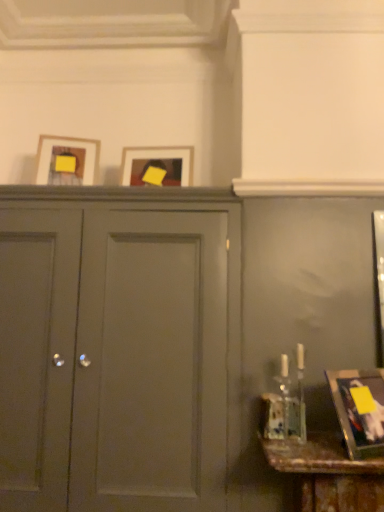
Question: Is matte wooden picture frame at center, the 1th picture frame viewed from the back, aimed at metallic gold picture frame at lower right, the 3th picture frame from the top?

Choices:
 (A) no
 (B) yes

Answer: (A)

Question: Does matte wooden picture frame at center, the 2th picture frame viewed from the right, have a greater width compared to metallic gold picture frame at lower right, acting as the 1th picture frame starting from the right?

Choices:
 (A) no
 (B) yes

Answer: (A)

Question: Is matte wooden picture frame at center, marked as the third picture frame in a front-to-back arrangement, outside of metallic gold picture frame at lower right, arranged as the 1th picture frame when viewed from the front?

Choices:
 (A) no
 (B) yes

Answer: (B)

Question: Does matte wooden picture frame at center, which ranks as the 2th picture frame in bottom-to-top order, come in front of metallic gold picture frame at lower right, the 3th picture frame from the top?

Choices:
 (A) no
 (B) yes

Answer: (A)

Question: Does matte wooden picture frame at center, which is counted as the second picture frame, starting from the left, have a lesser width compared to metallic gold picture frame at lower right, arranged as the 1th picture frame when viewed from the front?

Choices:
 (A) yes
 (B) no

Answer: (A)

Question: Is matte wooden picture frame at center, marked as the third picture frame in a front-to-back arrangement, far away from metallic gold picture frame at lower right, acting as the 1th picture frame starting from the right?

Choices:
 (A) no
 (B) yes

Answer: (B)

Question: From the image's perspective, is matte gray cabinet at center below metallic gold picture frame at lower right, positioned as the first picture frame in bottom-to-top order?

Choices:
 (A) no
 (B) yes

Answer: (A)

Question: Is matte gray cabinet at center facing towards metallic gold picture frame at lower right, positioned as the first picture frame in bottom-to-top order?

Choices:
 (A) no
 (B) yes

Answer: (A)

Question: Are matte gray cabinet at center and metallic gold picture frame at lower right, acting as the 1th picture frame starting from the right, far apart?

Choices:
 (A) no
 (B) yes

Answer: (A)

Question: Is matte gray cabinet at center at the right side of metallic gold picture frame at lower right, arranged as the 1th picture frame when viewed from the front?

Choices:
 (A) yes
 (B) no

Answer: (B)

Question: Is matte gray cabinet at center smaller than metallic gold picture frame at lower right, acting as the 1th picture frame starting from the right?

Choices:
 (A) yes
 (B) no

Answer: (B)

Question: Is metallic gold picture frame at lower right, marked as the 3th picture frame in a back-to-front arrangement, surrounded by matte gray cabinet at center?

Choices:
 (A) no
 (B) yes

Answer: (A)

Question: Is matte wooden picture frame at upper left, the third picture frame in the right-to-left sequence, located within metallic gold picture frame at lower right, positioned as the first picture frame in bottom-to-top order?

Choices:
 (A) no
 (B) yes

Answer: (A)